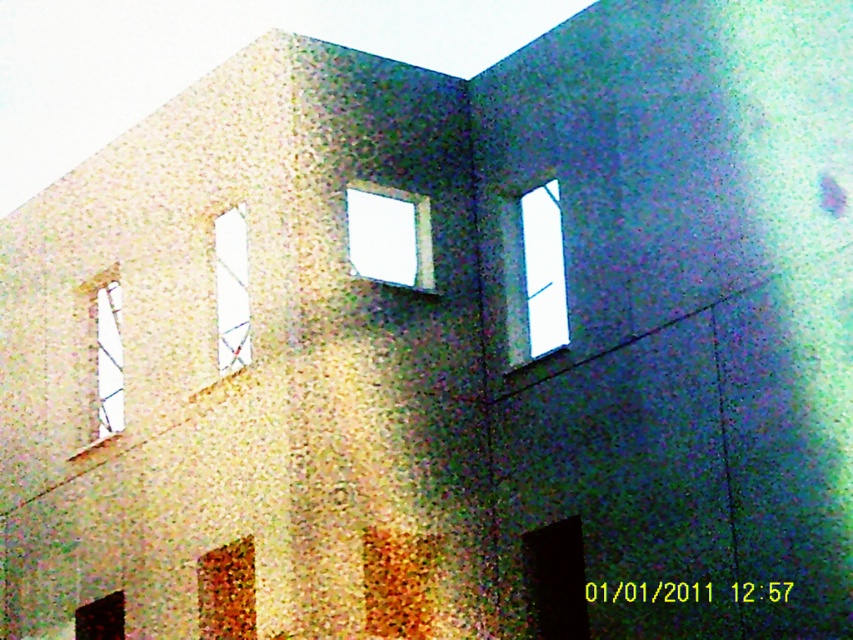
Can you confirm if transparent glass window at upper right is wider than clear glass window at center?

Yes, transparent glass window at upper right is wider than clear glass window at center.

Can you confirm if transparent glass window at upper right is positioned above clear glass window at center?

No.

Who is more distant from viewer, (538, 321) or (231, 339)?

The point (538, 321) is behind.

At what (x,y) coordinates should I click in order to perform the action: click on transparent glass window at upper right. Please return your answer as a coordinate pair (x, y). Looking at the image, I should click on (537, 273).

Is transparent glass window at center below matte brown wooden window at lower left?

Actually, transparent glass window at center is above matte brown wooden window at lower left.

Which of these two, transparent glass window at center or matte brown wooden window at lower left, stands taller?

With more height is matte brown wooden window at lower left.

Between point (383, 241) and point (224, 589), which one is positioned in front?

Positioned in front is point (224, 589).

Locate an element on the screen. transparent glass window at center is located at coordinates (389, 236).

Is transparent glass window at center shorter than clear glass window at center?

Incorrect, transparent glass window at center's height does not fall short of clear glass window at center's.

Which of these two, transparent glass window at center or clear glass window at center, stands taller?

With more height is transparent glass window at center.

This screenshot has height=640, width=853. What are the coordinates of `transparent glass window at center` in the screenshot? It's located at (389, 236).